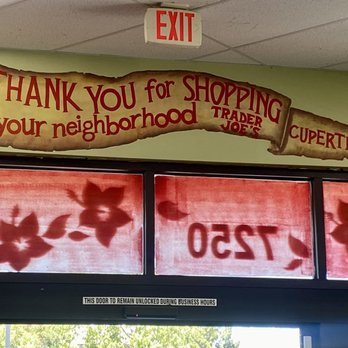
Image resolution: width=348 pixels, height=348 pixels. I want to click on glass, so click(x=262, y=209), click(x=116, y=265).